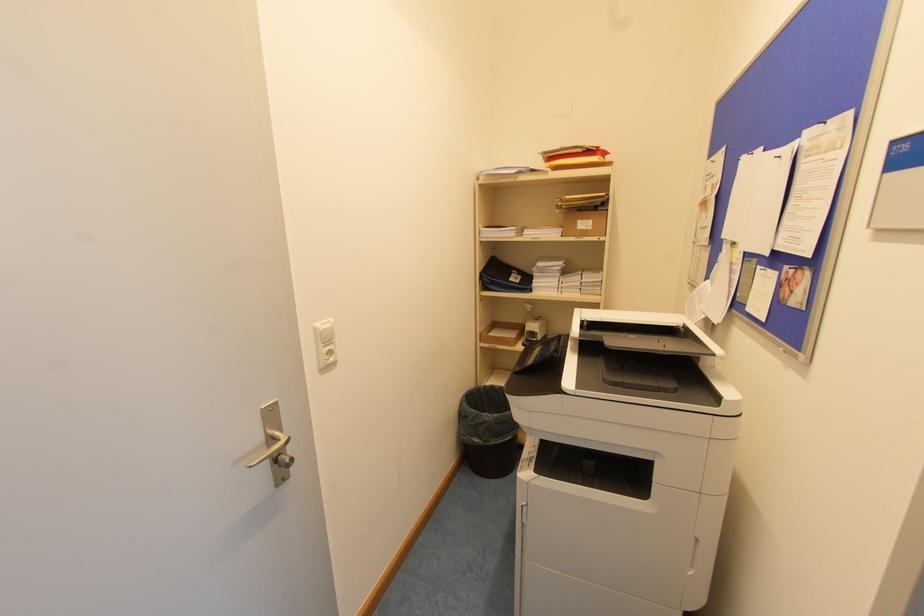
Where would you press the white dispenser pump? Please return your answer as a coordinate pair (x, y).

(541, 328)